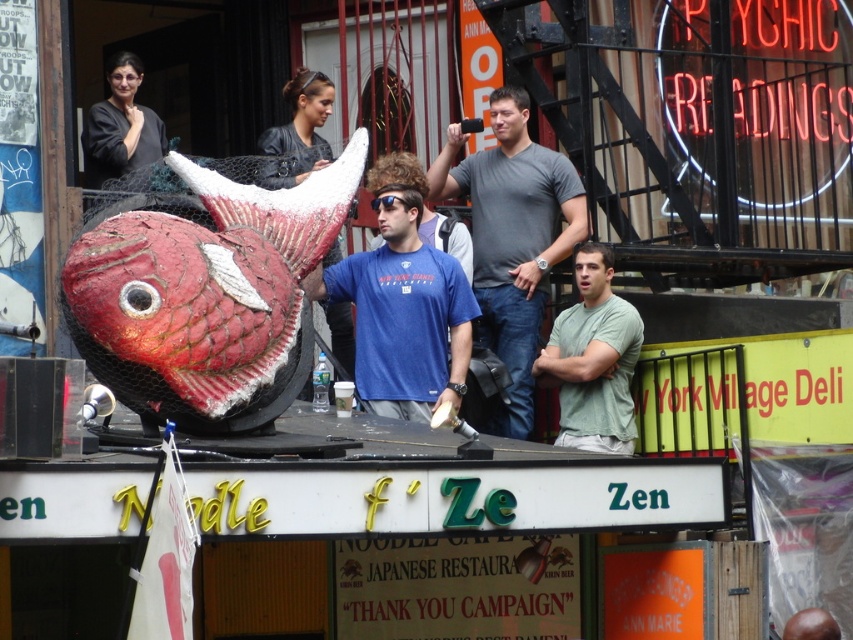
Question: Which object is the farthest from the matte black shirt at upper left?

Choices:
 (A) green matte shirt at center
 (B) neon red sign at upper right
 (C) black plastic goggles at center
 (D) gray cotton t-shirt at center

Answer: (A)

Question: Observing the image, what is the correct spatial positioning of neon red sign at upper right in reference to matte black shirt at upper left?

Choices:
 (A) right
 (B) left

Answer: (A)

Question: Estimate the real-world distances between objects in this image. Which object is farther from the green matte shirt at center?

Choices:
 (A) black plastic goggles at center
 (B) gray cotton t-shirt at center

Answer: (A)

Question: Does matte papier-mâché fish at center have a larger size compared to gray cotton t-shirt at center?

Choices:
 (A) no
 (B) yes

Answer: (B)

Question: Which is nearer to the neon red sign at upper right?

Choices:
 (A) matte black shirt at upper left
 (B) black plastic goggles at center

Answer: (B)

Question: Does matte papier-mâché fish at center have a larger size compared to matte black shirt at upper left?

Choices:
 (A) no
 (B) yes

Answer: (B)